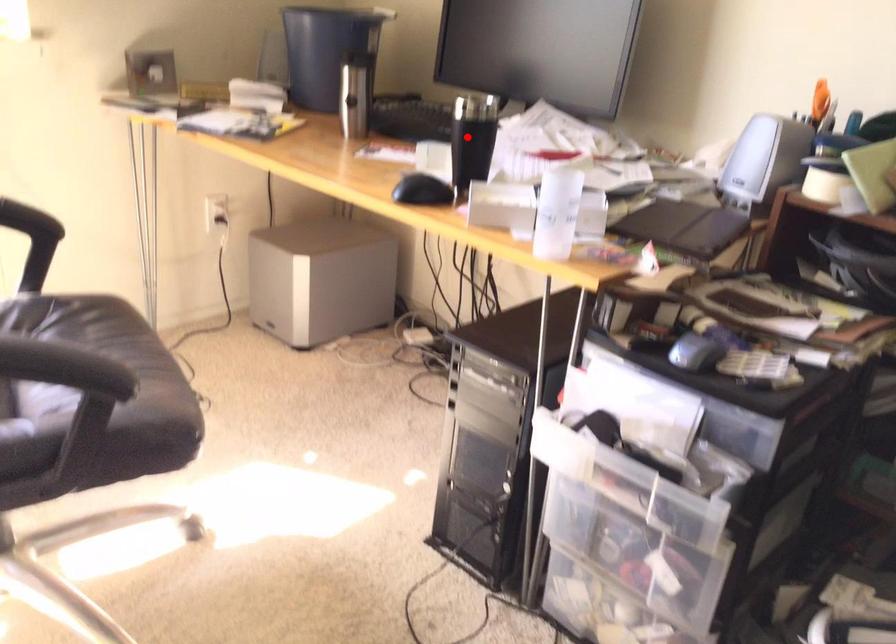
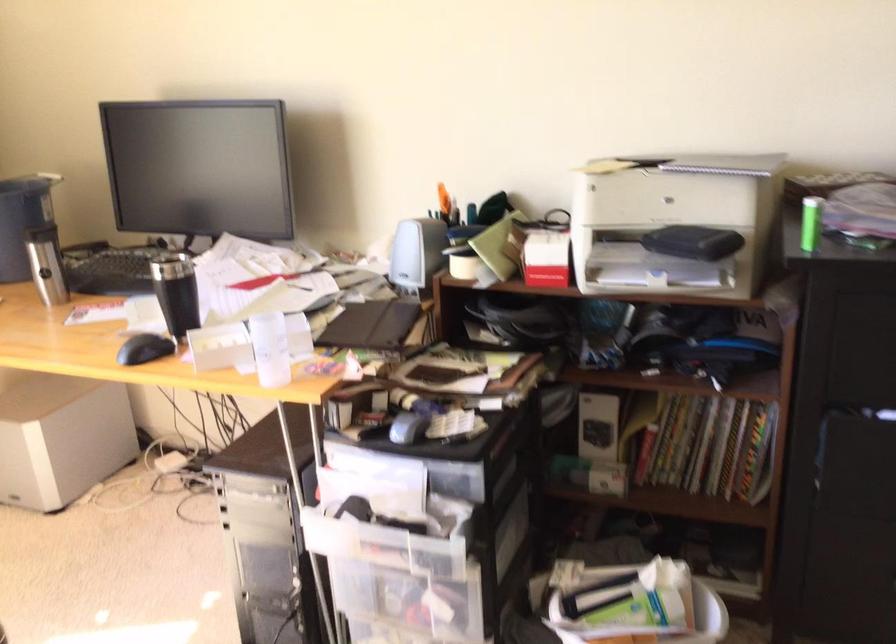
Where in the second image is the point corresponding to the highlighted location from the first image?

(176, 292)